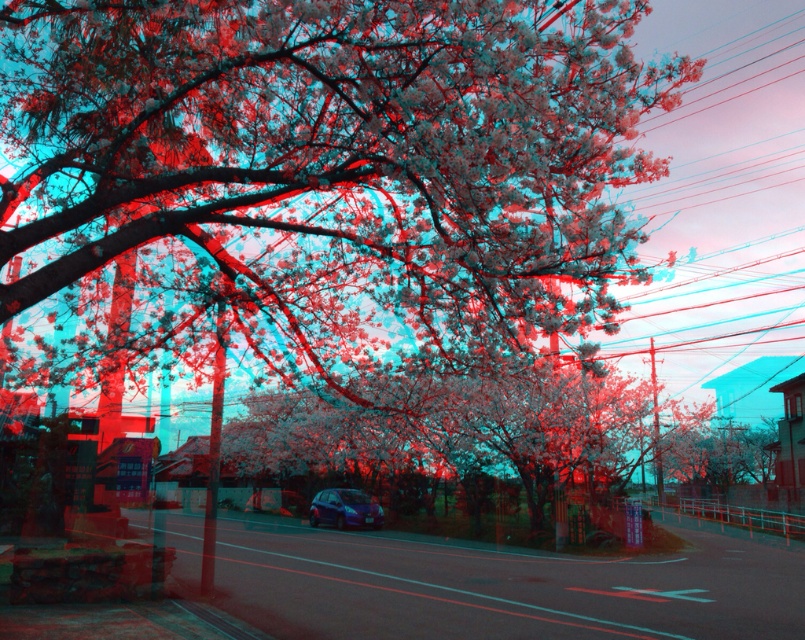
Which is more to the left, white matte flower at upper center or metallic blue hatchback at center?

metallic blue hatchback at center is more to the left.

Locate an element on the screen. white matte flower at upper center is located at coordinates (333, 161).

Identify the location of white matte flower at upper center. (333, 161).

This screenshot has width=805, height=640. I want to click on white matte flower at upper center, so click(x=333, y=161).